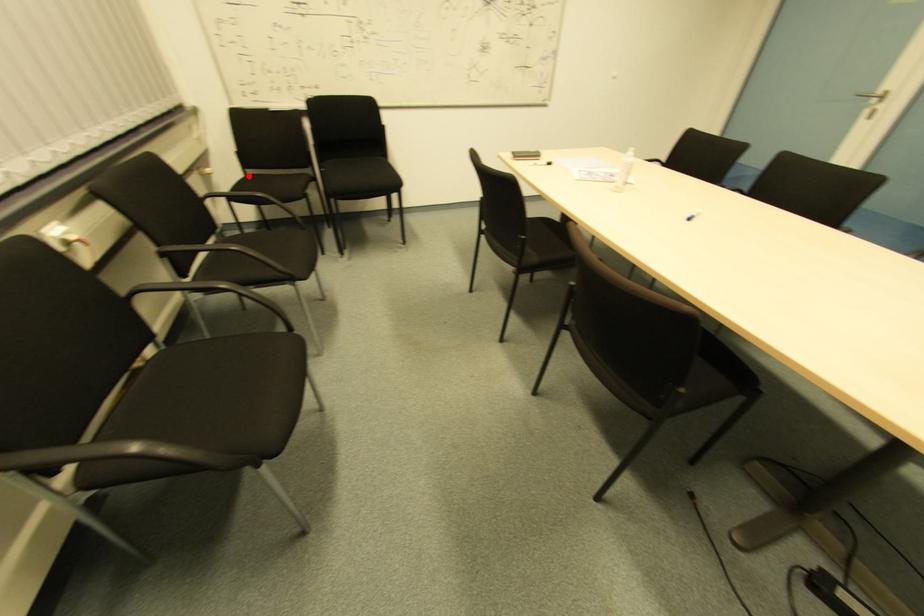
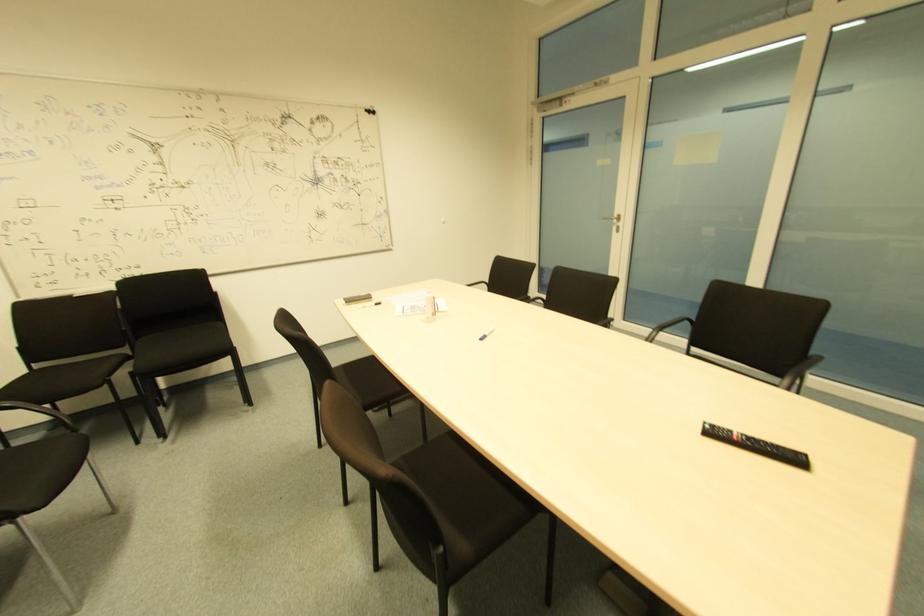
Find the pixel in the second image that matches the highlighted location in the first image.

(34, 370)